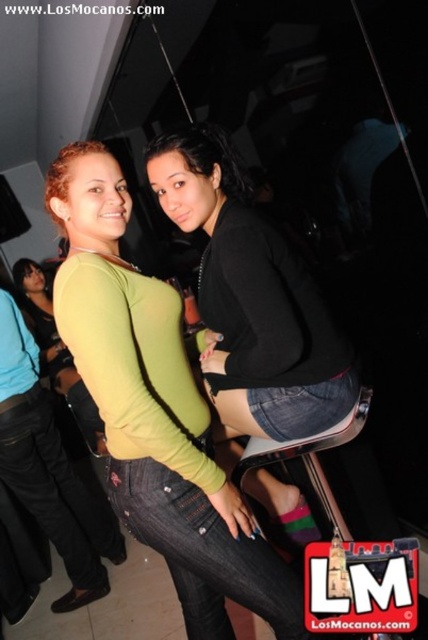
Which is behind, point (253, 584) or point (226, 230)?

The point (253, 584) is behind.

Which is more to the left, green matte shirt at center or black denim shorts at center?

From the viewer's perspective, green matte shirt at center appears more on the left side.

Find the location of a particular element. green matte shirt at center is located at coordinates (155, 412).